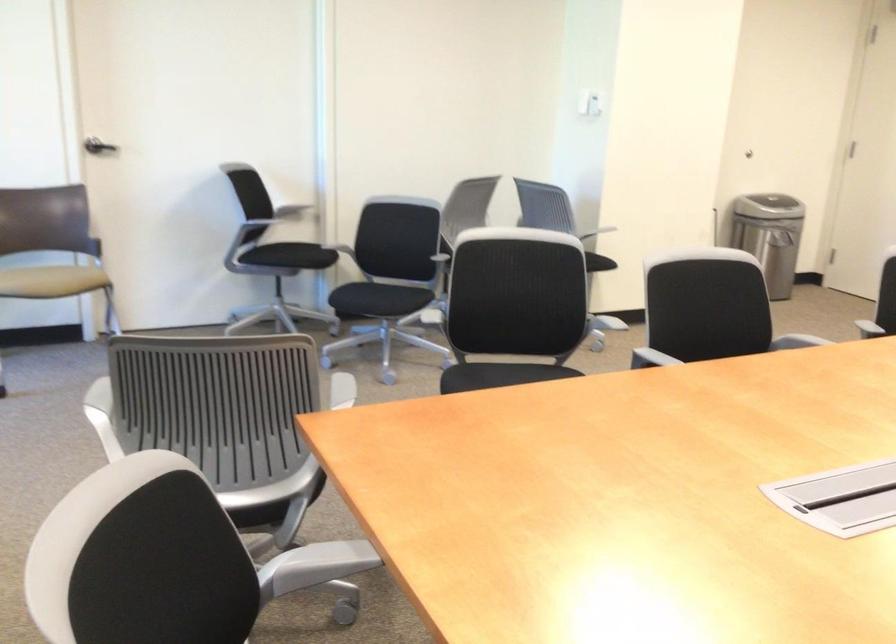
The height and width of the screenshot is (644, 896). What do you see at coordinates (320, 562) in the screenshot?
I see `the metal chair armrest` at bounding box center [320, 562].